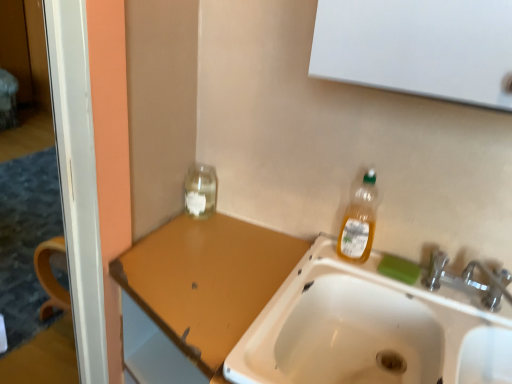
Locate an element on the screen. The height and width of the screenshot is (384, 512). vacant space in front of green matte bar of soap at sink right is located at coordinates (430, 305).